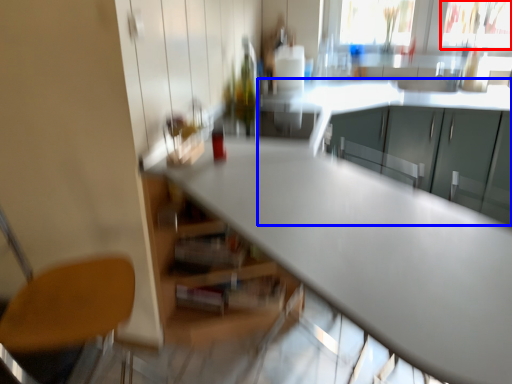
Question: Among these objects, which one is nearest to the camera, window screen (highlighted by a red box) or cabinetry (highlighted by a blue box)?

Choices:
 (A) window screen
 (B) cabinetry

Answer: (B)